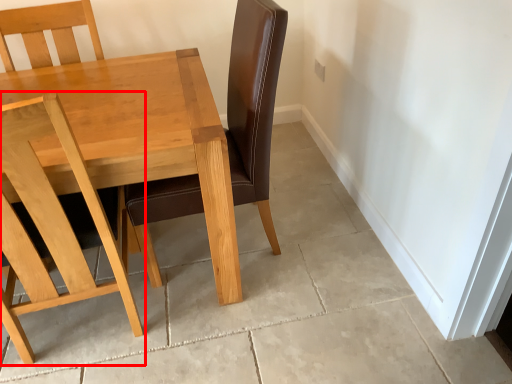
Question: In this image, where is chair (annotated by the red box) located relative to table?

Choices:
 (A) left
 (B) right

Answer: (B)